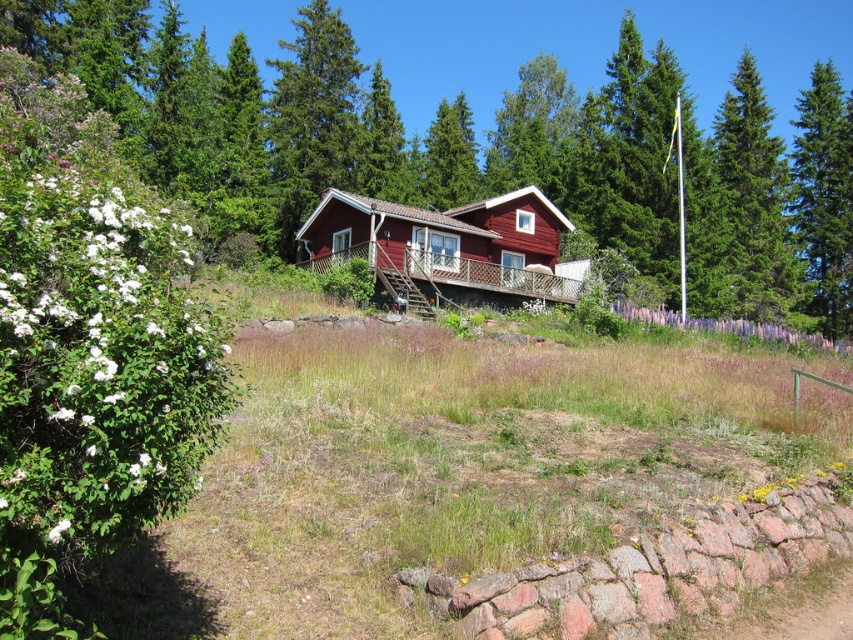
Is green coniferous tree at right further to camera compared to purple soft grass at center?

Yes, green coniferous tree at right is further from the viewer.

Which is below, green coniferous tree at right or purple soft grass at center?

Positioned lower is purple soft grass at center.

This screenshot has width=853, height=640. What do you see at coordinates (824, 196) in the screenshot?
I see `green coniferous tree at right` at bounding box center [824, 196].

The image size is (853, 640). What are the coordinates of `green coniferous tree at right` in the screenshot? It's located at (824, 196).

Does matte red cabin at center appear over green fir tree at upper right?

No, matte red cabin at center is not above green fir tree at upper right.

Which of these two, matte red cabin at center or green fir tree at upper right, stands taller?

Standing taller between the two is green fir tree at upper right.

Does point (306, 257) come farther from viewer compared to point (732, 145)?

That is False.

At what (x,y) coordinates should I click in order to perform the action: click on matte red cabin at center. Please return your answer as a coordinate pair (x, y). Looking at the image, I should click on (445, 244).

What do you see at coordinates (361, 125) in the screenshot? Image resolution: width=853 pixels, height=640 pixels. I see `green leafy tree at upper center` at bounding box center [361, 125].

Who is more forward, (779, 225) or (827, 108)?

Point (779, 225)

Where is `green leafy tree at upper center`? This screenshot has width=853, height=640. green leafy tree at upper center is located at coordinates (361, 125).